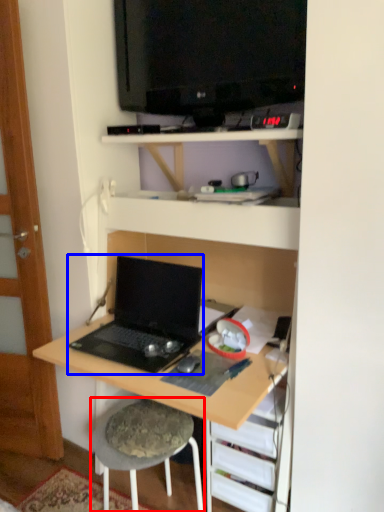
Question: Among these objects, which one is farthest to the camera, stool (highlighted by a red box) or laptop (highlighted by a blue box)?

Choices:
 (A) stool
 (B) laptop

Answer: (A)